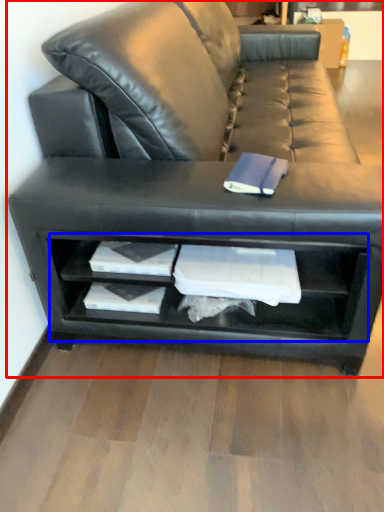
Question: Which object appears closest to the camera in this image, studio couch (highlighted by a red box) or shelf (highlighted by a blue box)?

Choices:
 (A) studio couch
 (B) shelf

Answer: (A)